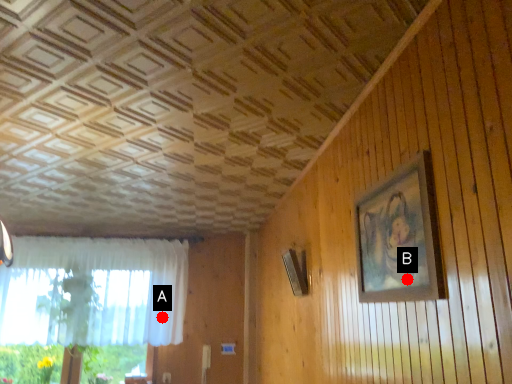
Question: Two points are circled on the image, labeled by A and B beside each circle. Which point appears farthest from the camera in this image?

Choices:
 (A) A is further
 (B) B is further

Answer: (A)